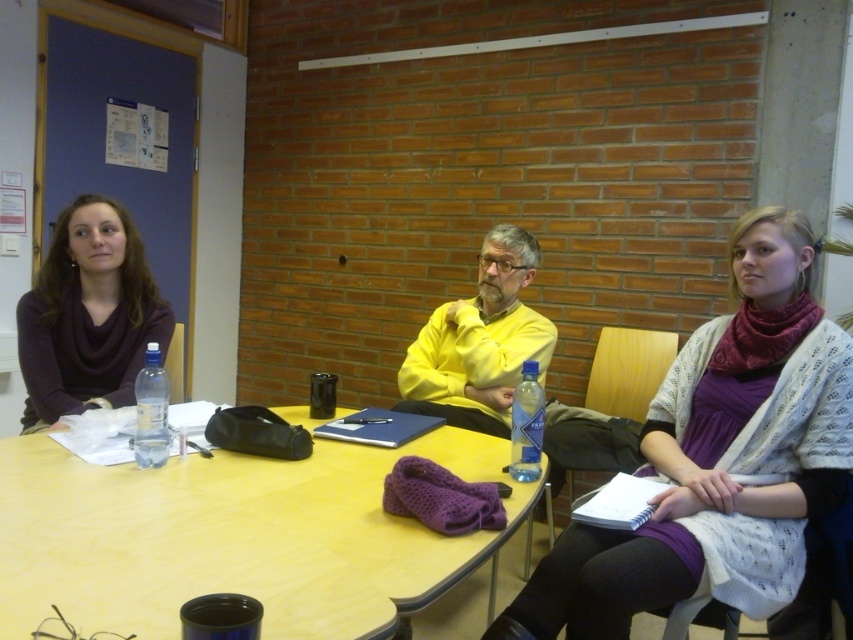
Does point (135, 394) come in front of point (524, 388)?

No, it is behind (524, 388).

Between point (154, 442) and point (523, 400), which one is positioned in front?

Point (154, 442) is more forward.

Who is more distant from viewer, (157, 384) or (519, 440)?

Positioned behind is point (519, 440).

The image size is (853, 640). I want to click on clear plastic bottle at table center, so click(x=151, y=410).

Who is taller, yellow matte shirt at center or clear plastic bottle at table center?

Standing taller between the two is yellow matte shirt at center.

Which is above, yellow matte shirt at center or clear plastic bottle at table center?

yellow matte shirt at center is higher up.

The height and width of the screenshot is (640, 853). Find the location of `yellow matte shirt at center`. yellow matte shirt at center is located at coordinates (479, 340).

Who is positioned more to the right, matte purple scarf at center or yellow matte shirt at center?

matte purple scarf at center is more to the right.

Which is in front, point (753, 444) or point (482, 371)?

Point (753, 444) is in front.

Between point (791, 372) and point (474, 349), which one is positioned behind?

Point (474, 349)

At what (x,y) coordinates should I click in order to perform the action: click on matte purple scarf at center. Please return your answer as a coordinate pair (x, y). The height and width of the screenshot is (640, 853). Looking at the image, I should click on (718, 458).